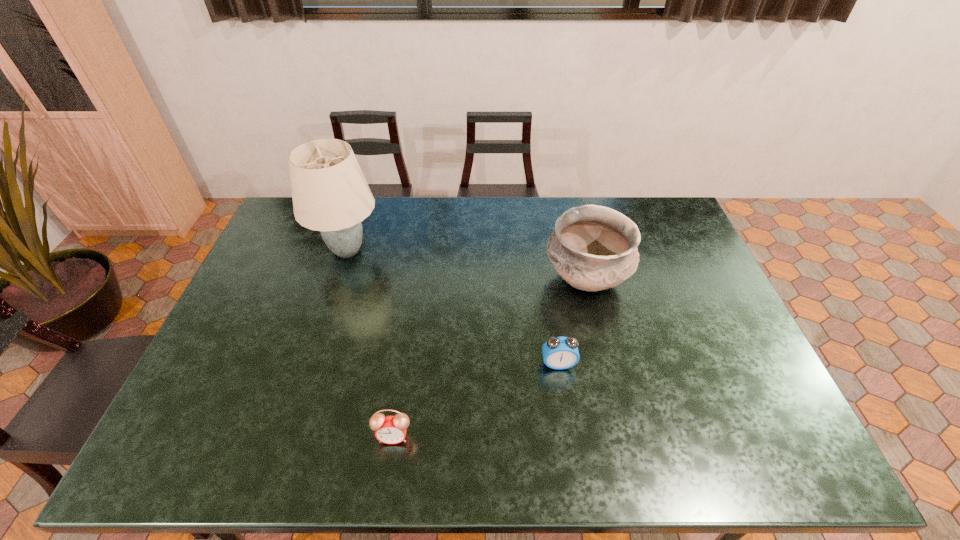
Where is `vacant space that satisfies the following two spatial constraints: 1. on the front side of the third shortest object; 2. on the left side of the lampshade`? The image size is (960, 540). vacant space that satisfies the following two spatial constraints: 1. on the front side of the third shortest object; 2. on the left side of the lampshade is located at coordinates (338, 280).